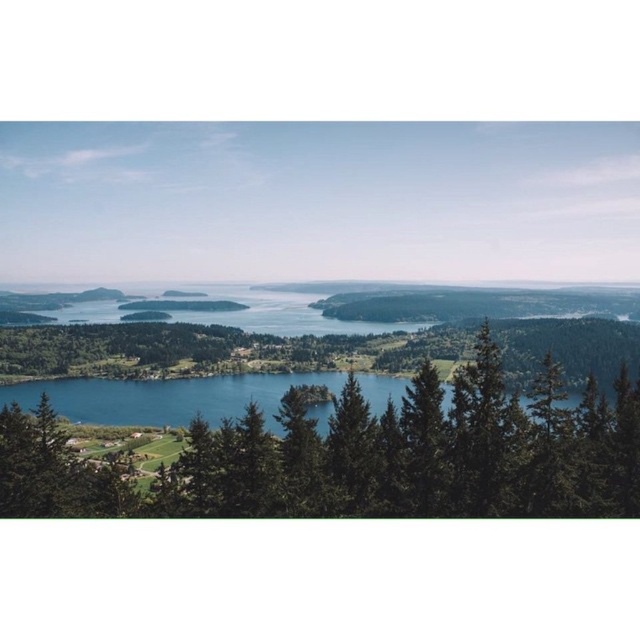
Is point (445, 435) behind point (182, 381)?

No, it is in front of (182, 381).

Can you confirm if green textured tree at center is smaller than blue water at center?

No, green textured tree at center is not smaller than blue water at center.

This screenshot has width=640, height=640. What do you see at coordinates (362, 456) in the screenshot?
I see `green textured tree at center` at bounding box center [362, 456].

Image resolution: width=640 pixels, height=640 pixels. I want to click on green textured tree at center, so click(x=362, y=456).